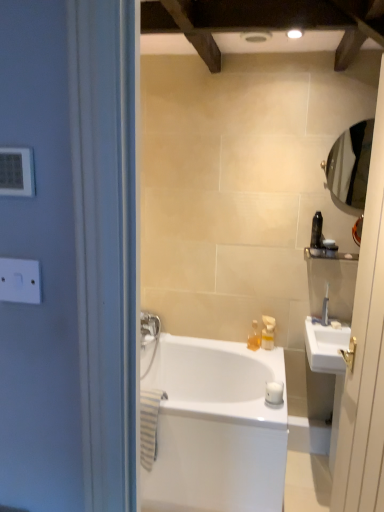
Question: Is white matte toilet paper at center further to camera compared to white plastic switch at upper left?

Choices:
 (A) no
 (B) yes

Answer: (B)

Question: Does white matte toilet paper at center turn towards white plastic switch at upper left?

Choices:
 (A) yes
 (B) no

Answer: (B)

Question: Is white matte toilet paper at center positioned in front of white plastic switch at upper left?

Choices:
 (A) no
 (B) yes

Answer: (A)

Question: Is white matte toilet paper at center wider than white plastic switch at upper left?

Choices:
 (A) no
 (B) yes

Answer: (B)

Question: Can you confirm if white matte toilet paper at center is taller than white plastic switch at upper left?

Choices:
 (A) no
 (B) yes

Answer: (A)

Question: Is white matte toilet paper at center to the left of white plastic switch at upper left from the viewer's perspective?

Choices:
 (A) yes
 (B) no

Answer: (B)

Question: Is black plastic toothbrush at right, which ranks as the second toiletry in left-to-right order, positioned beyond the bounds of white plastic switch at upper left?

Choices:
 (A) yes
 (B) no

Answer: (A)

Question: From a real-world perspective, is black plastic toothbrush at right, the 3th toiletry positioned from the bottom, on top of white plastic switch at upper left?

Choices:
 (A) yes
 (B) no

Answer: (B)

Question: Considering the relative sizes of black plastic toothbrush at right, which ranks as the second toiletry in left-to-right order, and white plastic switch at upper left in the image provided, is black plastic toothbrush at right, which ranks as the second toiletry in left-to-right order, smaller than white plastic switch at upper left?

Choices:
 (A) no
 (B) yes

Answer: (A)

Question: Is black plastic toothbrush at right, the 3th toiletry positioned from the bottom, to the left of white plastic switch at upper left from the viewer's perspective?

Choices:
 (A) yes
 (B) no

Answer: (B)

Question: Considering the relative sizes of black plastic toothbrush at right, which is counted as the 3th toiletry, starting from the back, and white plastic switch at upper left in the image provided, is black plastic toothbrush at right, which is counted as the 3th toiletry, starting from the back, wider than white plastic switch at upper left?

Choices:
 (A) no
 (B) yes

Answer: (B)

Question: From the image's perspective, is black plastic toothbrush at right, the 2th toiletry viewed from the right, over white plastic switch at upper left?

Choices:
 (A) no
 (B) yes

Answer: (B)

Question: Would you say white plastic switch at upper left is part of satin nickel faucet at upper right's contents?

Choices:
 (A) yes
 (B) no

Answer: (B)